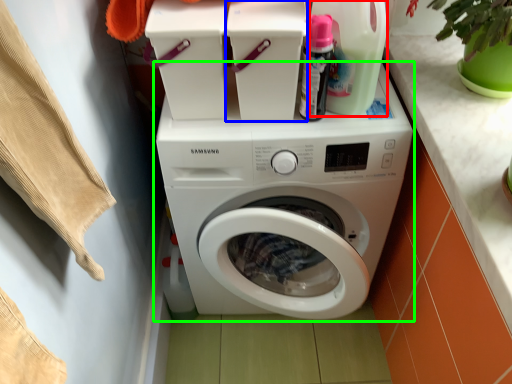
Question: Which is nearer to the cleaning product (highlighted by a red box)? appliance (highlighted by a blue box) or washing machine (highlighted by a green box).

Choices:
 (A) appliance
 (B) washing machine

Answer: (A)